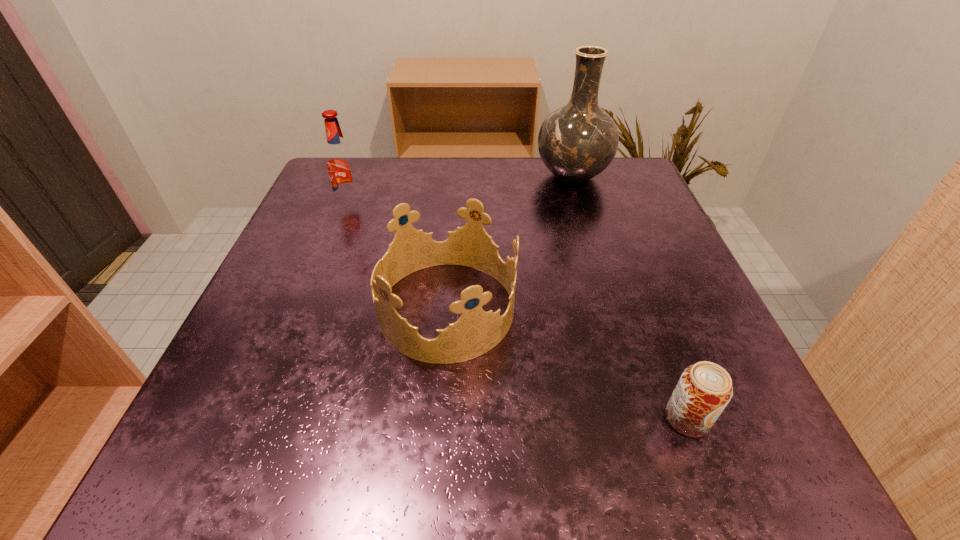
Identify the location of free space located on the front-facing side of the second shortest object. (665, 309).

Locate an element on the screen. The image size is (960, 540). free space located on the back of the beer can is located at coordinates (617, 232).

Image resolution: width=960 pixels, height=540 pixels. What are the coordinates of `vase at the far edge` in the screenshot? It's located at (578, 141).

Find the location of `root beer at the far edge`. root beer at the far edge is located at coordinates (340, 162).

Where is `object located in the near edge section of the desktop`? The image size is (960, 540). object located in the near edge section of the desktop is located at coordinates (704, 389).

Find the location of a particular element. object situated at the left edge is located at coordinates (340, 162).

The width and height of the screenshot is (960, 540). I want to click on vase positioned at the right edge, so click(x=578, y=141).

Identify the location of beer can that is at the right edge. Image resolution: width=960 pixels, height=540 pixels. click(x=704, y=389).

This screenshot has height=540, width=960. Identify the location of object that is at the far left corner. (340, 162).

Image resolution: width=960 pixels, height=540 pixels. Find the location of `object situated at the far right corner`. object situated at the far right corner is located at coordinates (578, 141).